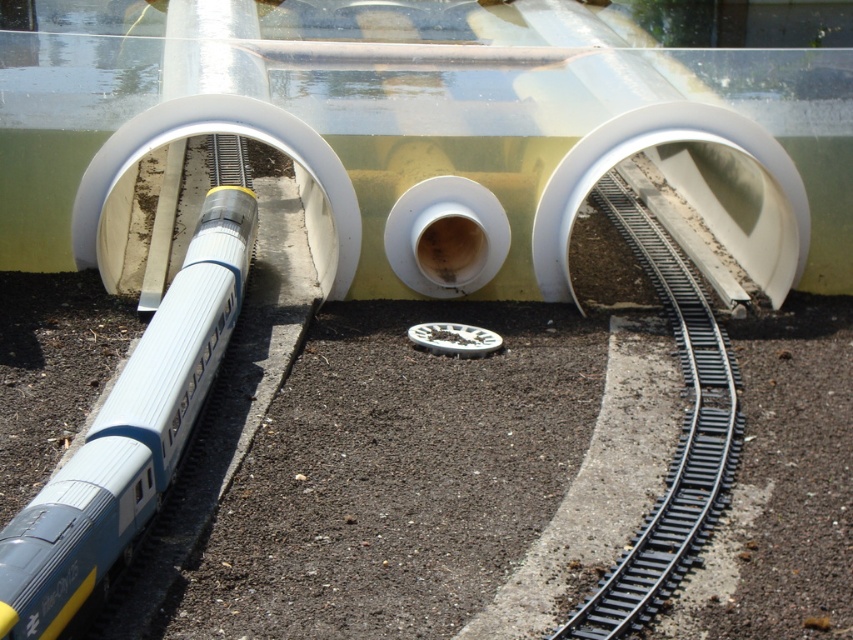
You are a model train enthusiast who wants to place a new decorative element between the silver metallic train at center and the black metal train track at center right. The decorative element is 10 feet long. Will it fit between them without overlapping either object?

The silver metallic train at center and the black metal train track at center right are 15.32 feet apart. Since the decorative element is 10 feet long, it will fit between them with 5.32 feet of space remaining on either side.

You are a model train enthusiast inspecting the miniature setup. You notice the silver metallic train at center and the black metal train track at center right. Which object is positioned closer to your viewpoint?

The silver metallic train at center is closer to the viewer than the black metal train track at center right.